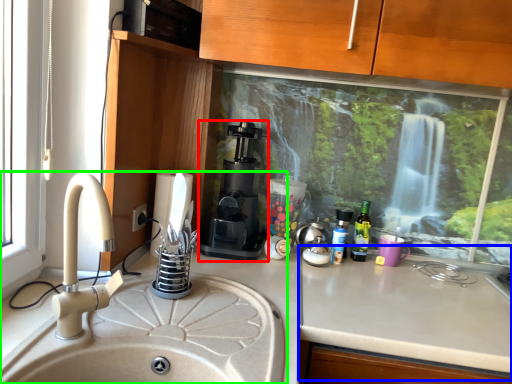
Question: Which object is positioned closest to coffee machine (highlighted by a red box)? Select from counter top (highlighted by a blue box) and sink (highlighted by a green box).

Choices:
 (A) counter top
 (B) sink

Answer: (B)